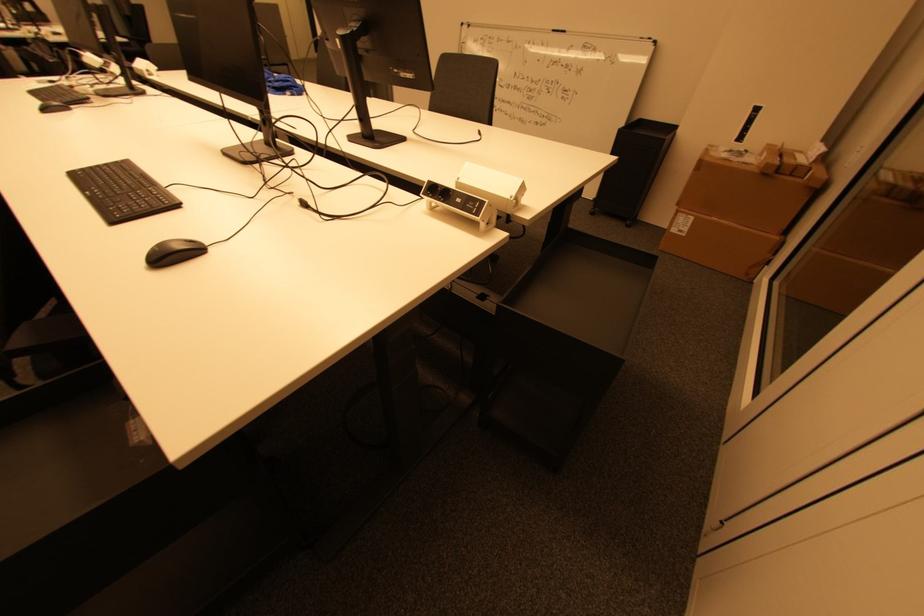
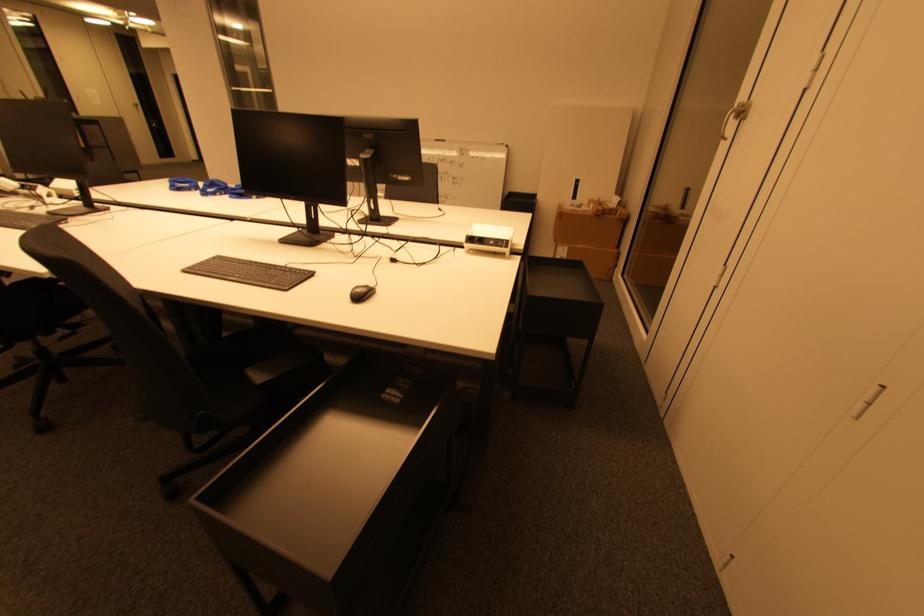
Question: The camera is either moving clockwise (left) or counter-clockwise (right) around the object. The first image is from the beginning of the video and the second image is from the end. Is the camera moving left or right when shooting the video?

Choices:
 (A) Left
 (B) Right

Answer: (A)